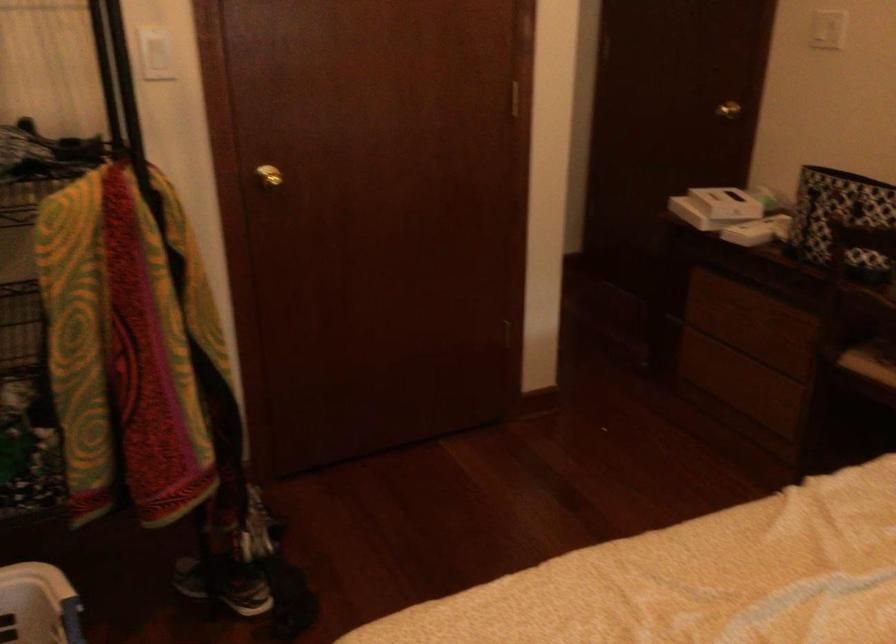
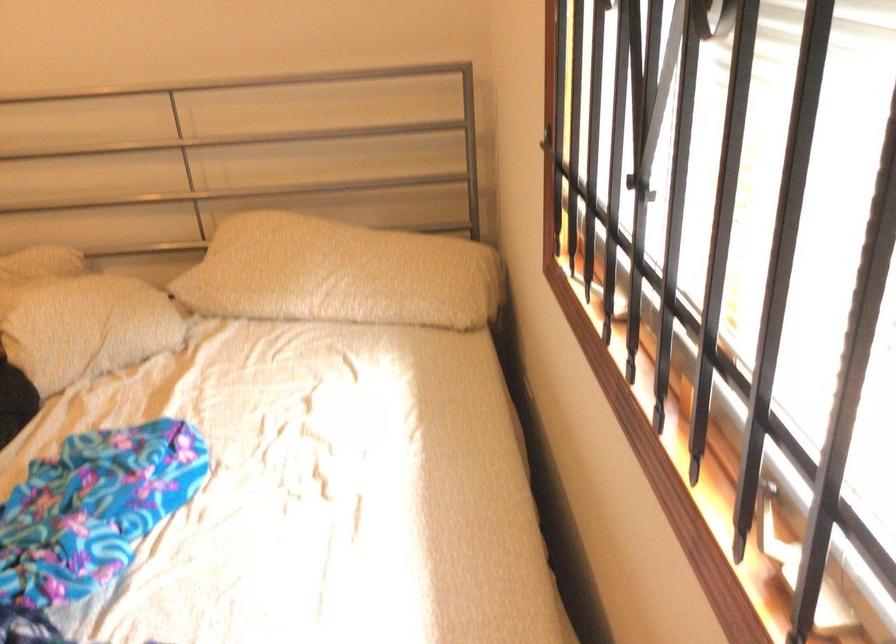
How did the camera likely rotate?

The rotation direction of the camera is right-down.